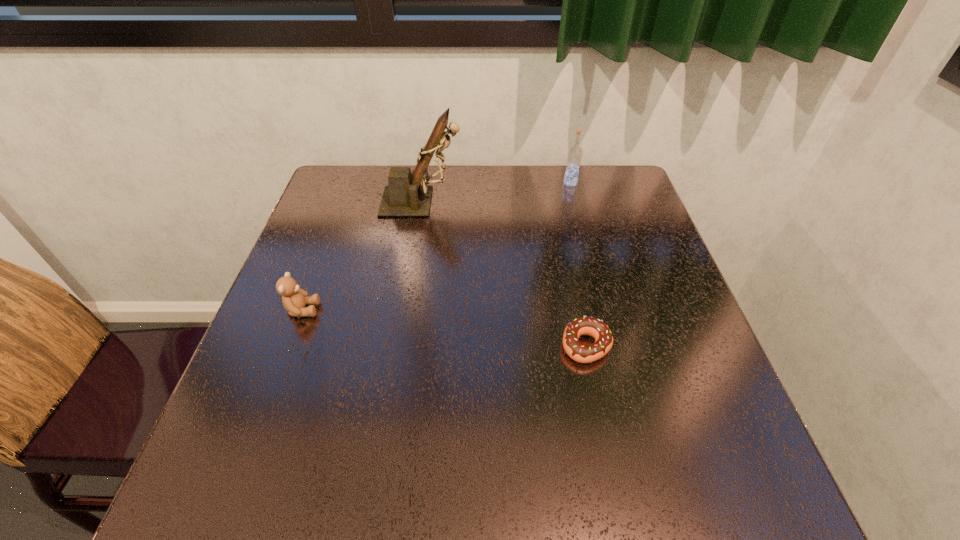
Find the location of a particular element. This screenshot has height=540, width=960. the tallest object is located at coordinates (404, 196).

Locate an element on the screen. Image resolution: width=960 pixels, height=540 pixels. the third object from right to left is located at coordinates (404, 196).

I want to click on the farthest object, so click(574, 156).

Where is `the second tallest object`? This screenshot has width=960, height=540. the second tallest object is located at coordinates (574, 156).

Find the location of a particular element. teddy bear is located at coordinates (294, 299).

Where is `the third tallest object`? the third tallest object is located at coordinates (294, 299).

Locate an element on the screen. This screenshot has width=960, height=540. the shortest object is located at coordinates (583, 353).

Locate an element on the screen. doughnut is located at coordinates (583, 353).

The height and width of the screenshot is (540, 960). Identify the location of vacant region located on the front-facing side of the third object from right to left. click(505, 202).

Locate an element on the screen. Image resolution: width=960 pixels, height=540 pixels. vacant region located on the front of the third shortest object is located at coordinates (579, 217).